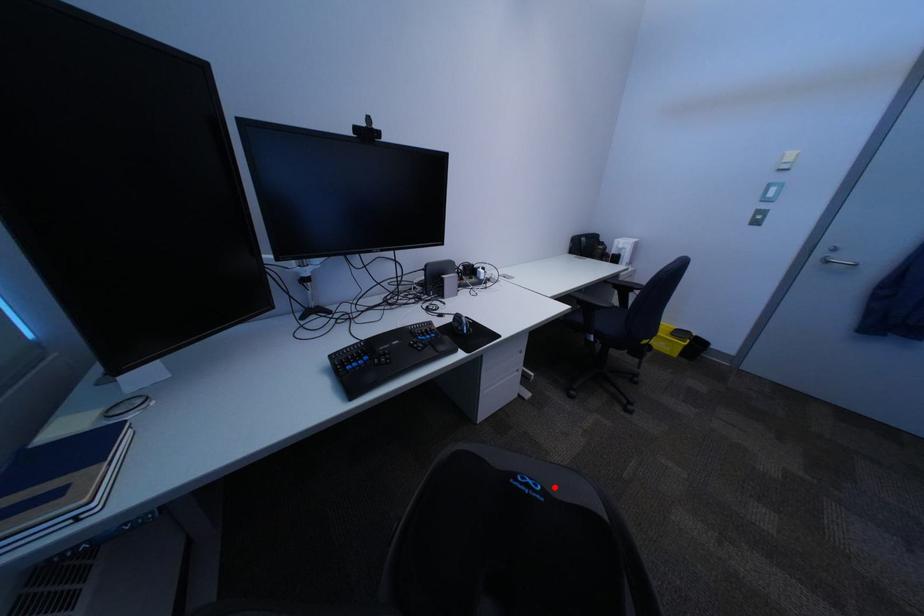
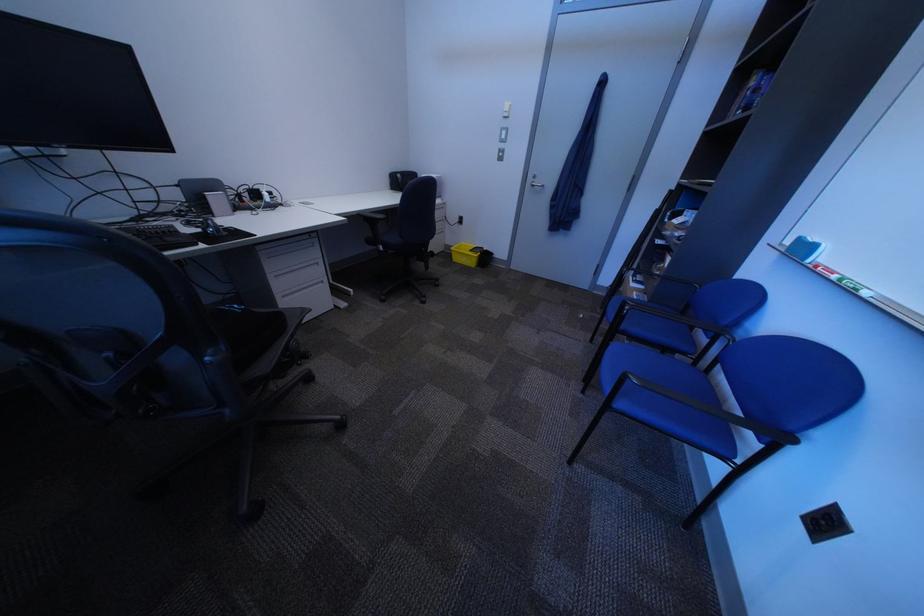
Locate, in the second image, the point that corresponds to the highlighted location in the first image.

(259, 309)